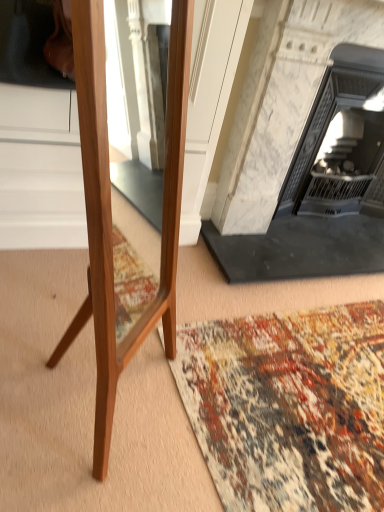
Question: Considering the relative sizes of white marble fireplace at upper right, the 2th fireplace viewed from the left, and white marble fireplace at center, arranged as the 1th fireplace when viewed from the left, in the image provided, is white marble fireplace at upper right, the 2th fireplace viewed from the left, shorter than white marble fireplace at center, arranged as the 1th fireplace when viewed from the left,?

Choices:
 (A) no
 (B) yes

Answer: (B)

Question: Is white marble fireplace at upper right, the 2th fireplace viewed from the left, positioned behind white marble fireplace at center, the 2th fireplace in the right-to-left sequence?

Choices:
 (A) yes
 (B) no

Answer: (A)

Question: Is the position of white marble fireplace at upper right, the 2th fireplace viewed from the left, less distant than that of white marble fireplace at center, the 2th fireplace in the right-to-left sequence?

Choices:
 (A) no
 (B) yes

Answer: (A)

Question: Considering the relative sizes of white marble fireplace at upper right, the 2th fireplace viewed from the left, and white marble fireplace at center, arranged as the 1th fireplace when viewed from the left, in the image provided, is white marble fireplace at upper right, the 2th fireplace viewed from the left, smaller than white marble fireplace at center, arranged as the 1th fireplace when viewed from the left,?

Choices:
 (A) no
 (B) yes

Answer: (B)

Question: Is white marble fireplace at upper right, the 2th fireplace viewed from the left, thinner than white marble fireplace at center, arranged as the 1th fireplace when viewed from the left?

Choices:
 (A) no
 (B) yes

Answer: (B)

Question: Is white marble fireplace at upper right, placed as the 1th fireplace when sorted from right to left, in front of or behind white marble fireplace at center, arranged as the 1th fireplace when viewed from the left, in the image?

Choices:
 (A) behind
 (B) front

Answer: (A)

Question: From a real-world perspective, relative to white marble fireplace at center, arranged as the 1th fireplace when viewed from the left, is white marble fireplace at upper right, placed as the 1th fireplace when sorted from right to left, vertically above or below?

Choices:
 (A) above
 (B) below

Answer: (B)

Question: Is point (340, 81) positioned closer to the camera than point (299, 265)?

Choices:
 (A) farther
 (B) closer

Answer: (B)

Question: Would you say white marble fireplace at upper right, the 2th fireplace viewed from the left, is inside or outside white marble fireplace at center, the 2th fireplace in the right-to-left sequence?

Choices:
 (A) inside
 (B) outside

Answer: (A)

Question: In terms of width, does white marble fireplace at center, the 2th fireplace in the right-to-left sequence, look wider or thinner when compared to multicolored woven rug at lower center?

Choices:
 (A) wide
 (B) thin

Answer: (B)

Question: From the image's perspective, is white marble fireplace at center, the 2th fireplace in the right-to-left sequence, above or below multicolored woven rug at lower center?

Choices:
 (A) below
 (B) above

Answer: (B)

Question: From a real-world perspective, is white marble fireplace at center, the 2th fireplace in the right-to-left sequence, positioned above or below multicolored woven rug at lower center?

Choices:
 (A) below
 (B) above

Answer: (B)

Question: Considering the positions of point (339, 76) and point (284, 323), is point (339, 76) closer or farther from the camera than point (284, 323)?

Choices:
 (A) farther
 (B) closer

Answer: (A)

Question: From a real-world perspective, is multicolored woven rug at lower center positioned above or below white marble fireplace at center, arranged as the 1th fireplace when viewed from the left?

Choices:
 (A) above
 (B) below

Answer: (B)

Question: Is multicolored woven rug at lower center in front of or behind white marble fireplace at center, arranged as the 1th fireplace when viewed from the left, in the image?

Choices:
 (A) front
 (B) behind

Answer: (A)